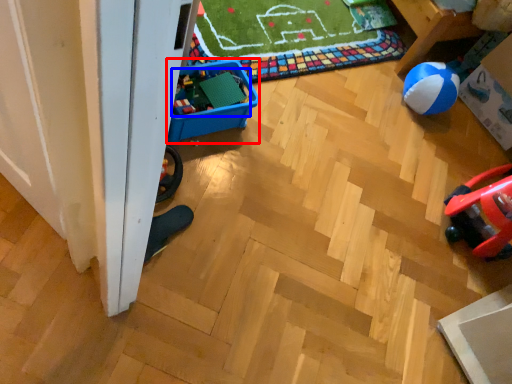
Question: Which point is closer to the camera, storage box (highlighted by a red box) or toy (highlighted by a blue box)?

Choices:
 (A) storage box
 (B) toy

Answer: (A)